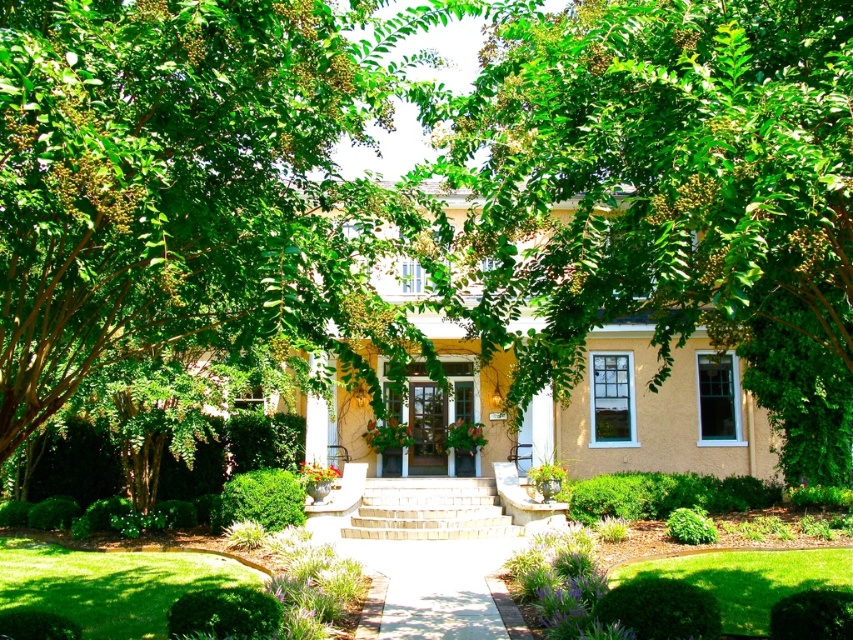
Which of these two, green leafy tree at center or smooth concrete path at center, stands shorter?

smooth concrete path at center is shorter.

Which is behind, point (560, 292) or point (436, 556)?

Point (436, 556)

The width and height of the screenshot is (853, 640). What are the coordinates of `green leafy tree at center` in the screenshot? It's located at (671, 195).

Between green leafy tree at center and green leafy tree at upper left, which one appears on the left side from the viewer's perspective?

green leafy tree at upper left

Is green leafy tree at center taller than green leafy tree at upper left?

Correct, green leafy tree at center is much taller as green leafy tree at upper left.

Between point (496, 42) and point (264, 156), which one is positioned in front?

Positioned in front is point (264, 156).

Find the location of a particular element. green leafy tree at center is located at coordinates (671, 195).

Is green grass at lower left below smooth concrete path at center?

Yes, green grass at lower left is below smooth concrete path at center.

Does point (177, 580) come farther from viewer compared to point (419, 595)?

Yes, it is behind point (419, 595).

Where is `green grass at lower left`? This screenshot has height=640, width=853. green grass at lower left is located at coordinates click(x=109, y=584).